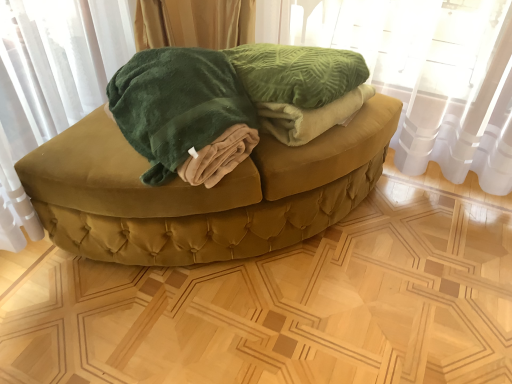
Question: From the image's perspective, is velvet green ottoman at center positioned above or below green velvet curtain at upper center?

Choices:
 (A) above
 (B) below

Answer: (B)

Question: Is velvet green ottoman at center to the left or to the right of green velvet curtain at upper center in the image?

Choices:
 (A) left
 (B) right

Answer: (A)

Question: Which is farther from the green velvet curtain at upper center?

Choices:
 (A) velvet green ottoman at center
 (B) velvety green blanket at center

Answer: (B)

Question: Which object is the farthest from the velvety green blanket at center?

Choices:
 (A) green velvet curtain at upper center
 (B) velvet green ottoman at center

Answer: (A)